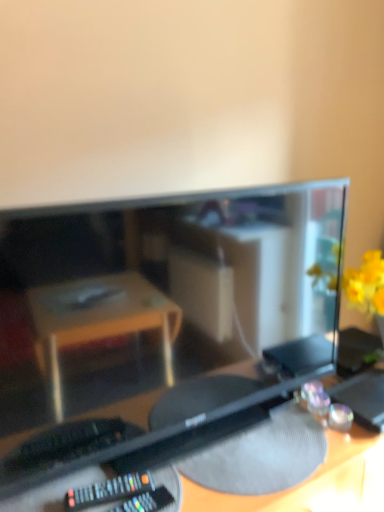
Question: Is black plastic remote at lower left at the right side of black plastic desk at center?

Choices:
 (A) yes
 (B) no

Answer: (B)

Question: Is the position of black plastic remote at lower left more distant than that of black plastic desk at center?

Choices:
 (A) no
 (B) yes

Answer: (B)

Question: Is black plastic remote at lower left outside of black plastic desk at center?

Choices:
 (A) yes
 (B) no

Answer: (A)

Question: Can you confirm if black plastic remote at lower left is shorter than black plastic desk at center?

Choices:
 (A) no
 (B) yes

Answer: (B)

Question: Is black plastic remote at lower left closer to the viewer compared to black plastic desk at center?

Choices:
 (A) yes
 (B) no

Answer: (B)

Question: Considering the relative sizes of black plastic remote at lower left and black plastic desk at center in the image provided, is black plastic remote at lower left thinner than black plastic desk at center?

Choices:
 (A) yes
 (B) no

Answer: (A)

Question: Considering the relative sizes of black plastic desk at center and matte black monitor at center in the image provided, is black plastic desk at center shorter than matte black monitor at center?

Choices:
 (A) no
 (B) yes

Answer: (A)

Question: Is black plastic desk at center to the left of matte black monitor at center from the viewer's perspective?

Choices:
 (A) yes
 (B) no

Answer: (B)

Question: Is black plastic desk at center far away from matte black monitor at center?

Choices:
 (A) no
 (B) yes

Answer: (A)

Question: Is black plastic desk at center next to matte black monitor at center and touching it?

Choices:
 (A) no
 (B) yes

Answer: (A)

Question: From a real-world perspective, is black plastic desk at center located beneath matte black monitor at center?

Choices:
 (A) yes
 (B) no

Answer: (A)

Question: Does black plastic desk at center have a greater height compared to matte black monitor at center?

Choices:
 (A) yes
 (B) no

Answer: (A)

Question: Is matte black monitor at center placed right next to black plastic desk at center?

Choices:
 (A) yes
 (B) no

Answer: (B)